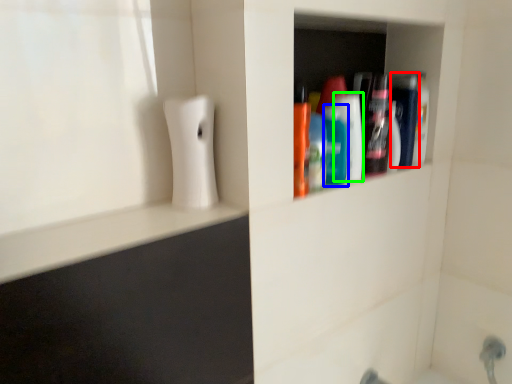
Question: Which object is positioned closest to mouthwash (highlighted by a red box)? Select from mouthwash (highlighted by a blue box) and mouthwash (highlighted by a green box).

Choices:
 (A) mouthwash
 (B) mouthwash

Answer: (B)